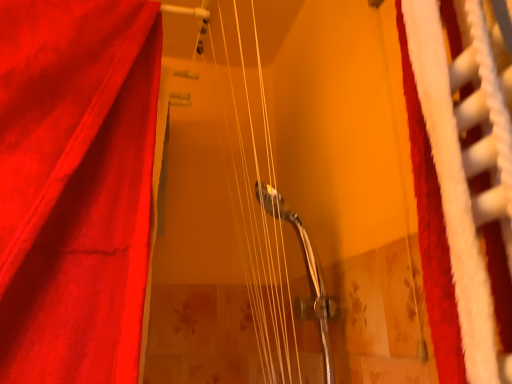
Find the location of a particular element. Image resolution: width=512 pixels, height=384 pixels. velvet red curtain at right is located at coordinates (465, 190).

The image size is (512, 384). Describe the element at coordinates (465, 190) in the screenshot. I see `velvet red curtain at right` at that location.

This screenshot has width=512, height=384. In order to click on velvet red curtain at right in this screenshot , I will do `click(465, 190)`.